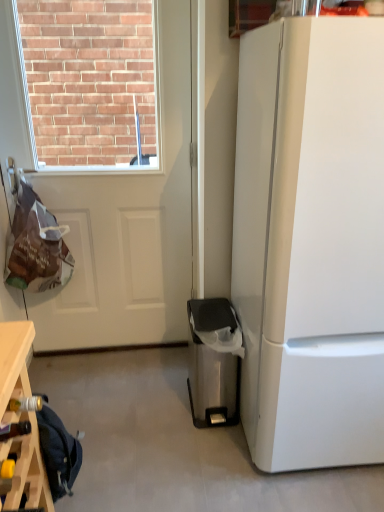
Question: From a real-world perspective, does white matte door at upper left stand above stainless steel trash can at lower right?

Choices:
 (A) yes
 (B) no

Answer: (A)

Question: From the image's perspective, is white matte door at upper left located beneath stainless steel trash can at lower right?

Choices:
 (A) no
 (B) yes

Answer: (A)

Question: From a real-world perspective, is white matte door at upper left positioned under stainless steel trash can at lower right based on gravity?

Choices:
 (A) yes
 (B) no

Answer: (B)

Question: Is white matte door at upper left to the left of stainless steel trash can at lower right from the viewer's perspective?

Choices:
 (A) no
 (B) yes

Answer: (B)

Question: From the image's perspective, would you say white matte door at upper left is positioned over stainless steel trash can at lower right?

Choices:
 (A) yes
 (B) no

Answer: (A)

Question: Considering the relative sizes of white matte door at upper left and stainless steel trash can at lower right in the image provided, is white matte door at upper left bigger than stainless steel trash can at lower right?

Choices:
 (A) yes
 (B) no

Answer: (A)

Question: Does wooden wine rack at lower left come in front of white glossy refrigerator at right?

Choices:
 (A) yes
 (B) no

Answer: (B)

Question: Can you confirm if wooden wine rack at lower left is smaller than white glossy refrigerator at right?

Choices:
 (A) yes
 (B) no

Answer: (A)

Question: Does wooden wine rack at lower left appear on the right side of white glossy refrigerator at right?

Choices:
 (A) yes
 (B) no

Answer: (B)

Question: Can you confirm if wooden wine rack at lower left is bigger than white glossy refrigerator at right?

Choices:
 (A) no
 (B) yes

Answer: (A)

Question: Is wooden wine rack at lower left next to white glossy refrigerator at right and touching it?

Choices:
 (A) no
 (B) yes

Answer: (A)

Question: From a real-world perspective, is wooden wine rack at lower left located beneath white glossy refrigerator at right?

Choices:
 (A) no
 (B) yes

Answer: (B)

Question: From the image's perspective, is stainless steel trash can at lower right located beneath white glossy refrigerator at right?

Choices:
 (A) no
 (B) yes

Answer: (B)